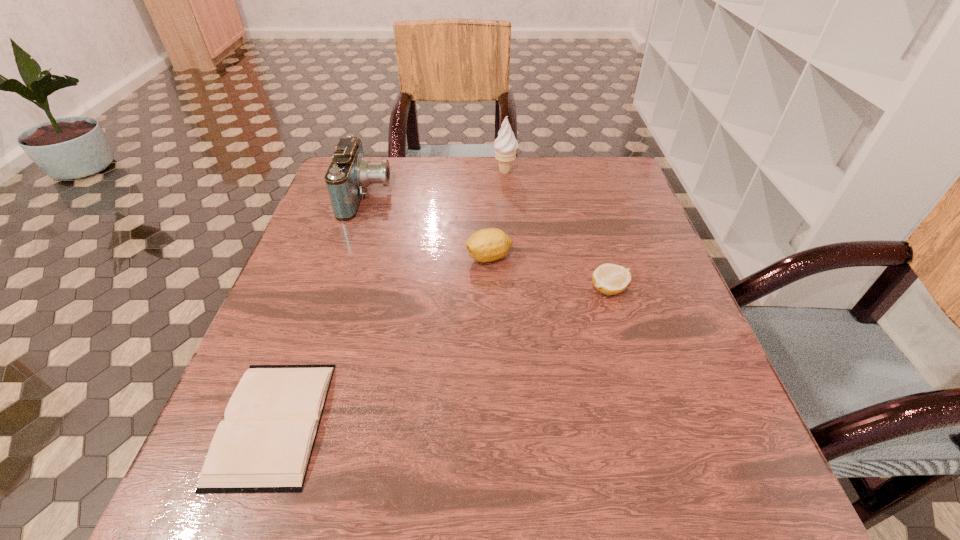
At what (x,y) coordinates should I click in order to perform the action: click on empty space between the tallest object and the nearest object. Please return your answer as a coordinate pair (x, y). This screenshot has width=960, height=540. Looking at the image, I should click on (389, 297).

At what (x,y) coordinates should I click in order to perform the action: click on vacant space that's between the camcorder and the icecream. Please return your answer as a coordinate pair (x, y). The width and height of the screenshot is (960, 540). Looking at the image, I should click on (436, 184).

Find the location of a particular element. This screenshot has width=960, height=540. free space between the shortest object and the taller lemon is located at coordinates (381, 340).

Find the location of a particular element. The height and width of the screenshot is (540, 960). vacant area that lies between the farther lemon and the camcorder is located at coordinates (428, 227).

Image resolution: width=960 pixels, height=540 pixels. I want to click on free space between the left lemon and the nearest object, so click(381, 340).

I want to click on vacant space that's between the third tallest object and the rightmost object, so click(549, 273).

You are a GUI agent. You are given a task and a screenshot of the screen. Output one action in this format:
    pyautogui.click(x=<x>, y=<y>)
    Task: Click on the free space between the second tallest object and the left lemon
    The image size is (960, 540).
    Given the screenshot: What is the action you would take?
    pyautogui.click(x=428, y=227)

Point out which object is positioned as the third nearest to the shortest object. Please provide its 2D coordinates. Your answer should be formatted as a tuple, i.e. [(x, y)], where the tuple contains the x and y coordinates of a point satisfying the conditions above.

[(610, 279)]

You are a GUI agent. You are given a task and a screenshot of the screen. Output one action in this format:
    pyautogui.click(x=<x>, y=<y>)
    Task: Click on the fourth closest object relative to the nearest object
    This screenshot has width=960, height=540.
    Given the screenshot: What is the action you would take?
    pyautogui.click(x=505, y=145)

I want to click on free location that satisfies the following two spatial constraints: 1. on the front-facing side of the tallest object; 2. at the stem end of the third shortest object, so click(512, 257).